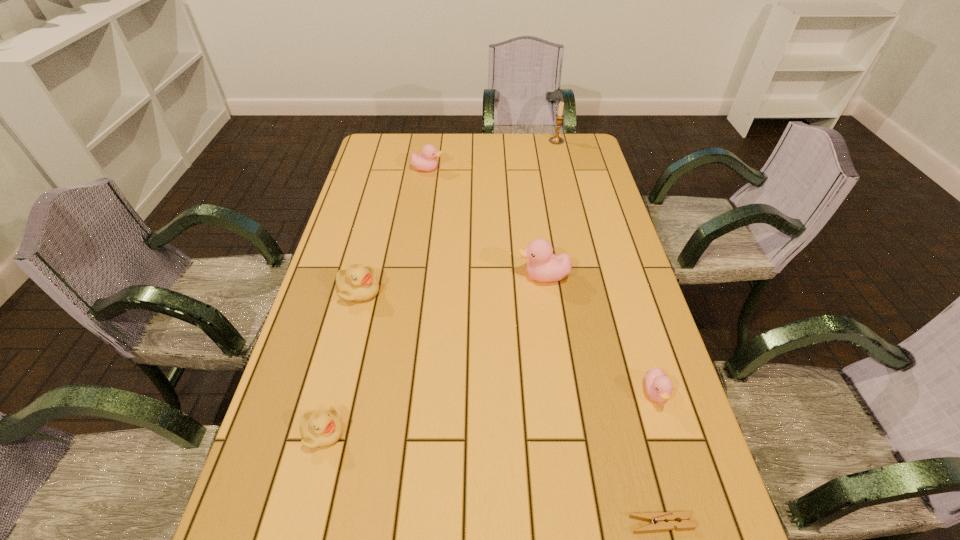
The image size is (960, 540). What are the coordinates of `candle holder` in the screenshot? It's located at (556, 140).

I want to click on the tallest object, so click(x=556, y=140).

In order to click on the second duckling from right to left in this screenshot , I will do `click(543, 266)`.

Find the location of a particular element. The image size is (960, 540). the biggest pink duckling is located at coordinates (543, 266).

What are the coordinates of `the farthest pink duckling` in the screenshot? It's located at (427, 161).

Locate an element on the screen. The height and width of the screenshot is (540, 960). the third duckling from left to right is located at coordinates (427, 161).

Locate an element on the screen. The width and height of the screenshot is (960, 540). the farther yellow duckling is located at coordinates (357, 283).

The height and width of the screenshot is (540, 960). Identify the location of the fourth farthest duckling. (658, 385).

Locate an element on the screen. The width and height of the screenshot is (960, 540). the rightmost pink duckling is located at coordinates (658, 385).

The height and width of the screenshot is (540, 960). Identify the location of the nearest duckling. (320, 428).